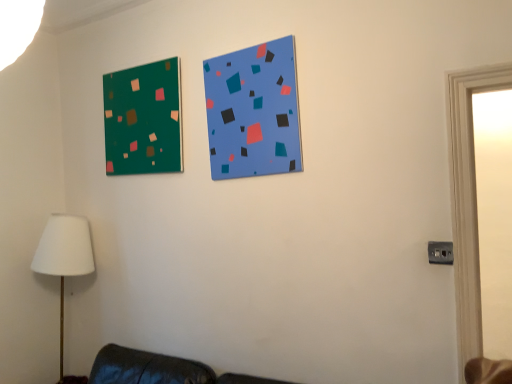
Question: Is white fabric lampshade at lower left at the left side of blue matte bulletin board at upper center, the first bulletin board positioned from the front?

Choices:
 (A) no
 (B) yes

Answer: (B)

Question: From a real-world perspective, is white fabric lampshade at lower left positioned over blue matte bulletin board at upper center, the first bulletin board in the right-to-left sequence, based on gravity?

Choices:
 (A) no
 (B) yes

Answer: (A)

Question: Is white fabric lampshade at lower left positioned before blue matte bulletin board at upper center, the 2th bulletin board in the left-to-right sequence?

Choices:
 (A) no
 (B) yes

Answer: (A)

Question: Are white fabric lampshade at lower left and blue matte bulletin board at upper center, the first bulletin board positioned from the front, making contact?

Choices:
 (A) yes
 (B) no

Answer: (B)

Question: Can you confirm if white fabric lampshade at lower left is shorter than blue matte bulletin board at upper center, the first bulletin board positioned from the front?

Choices:
 (A) no
 (B) yes

Answer: (A)

Question: From the image's perspective, is white fabric lampshade at lower left under blue matte bulletin board at upper center, the 2th bulletin board in the left-to-right sequence?

Choices:
 (A) yes
 (B) no

Answer: (A)

Question: Considering the relative sizes of white fabric lampshade at lower left and green matte board at upper left, which is the 1th bulletin board from left to right, in the image provided, is white fabric lampshade at lower left thinner than green matte board at upper left, which is the 1th bulletin board from left to right,?

Choices:
 (A) no
 (B) yes

Answer: (A)

Question: Is green matte board at upper left, the 1th bulletin board viewed from the back, at the back of white fabric lampshade at lower left?

Choices:
 (A) yes
 (B) no

Answer: (B)

Question: Can green matte board at upper left, which is the 1th bulletin board from left to right, be found inside white fabric lampshade at lower left?

Choices:
 (A) no
 (B) yes

Answer: (A)

Question: Does white fabric lampshade at lower left have a greater width compared to green matte board at upper left, the 1th bulletin board viewed from the back?

Choices:
 (A) yes
 (B) no

Answer: (A)

Question: Does white fabric lampshade at lower left turn towards green matte board at upper left, which is counted as the 2th bulletin board, starting from the right?

Choices:
 (A) no
 (B) yes

Answer: (A)

Question: From the image's perspective, does white fabric lampshade at lower left appear higher than green matte board at upper left, the second bulletin board viewed from the front?

Choices:
 (A) yes
 (B) no

Answer: (B)

Question: Is green matte board at upper left, the second bulletin board viewed from the front, positioned in front of white fabric lampshade at lower left?

Choices:
 (A) yes
 (B) no

Answer: (A)